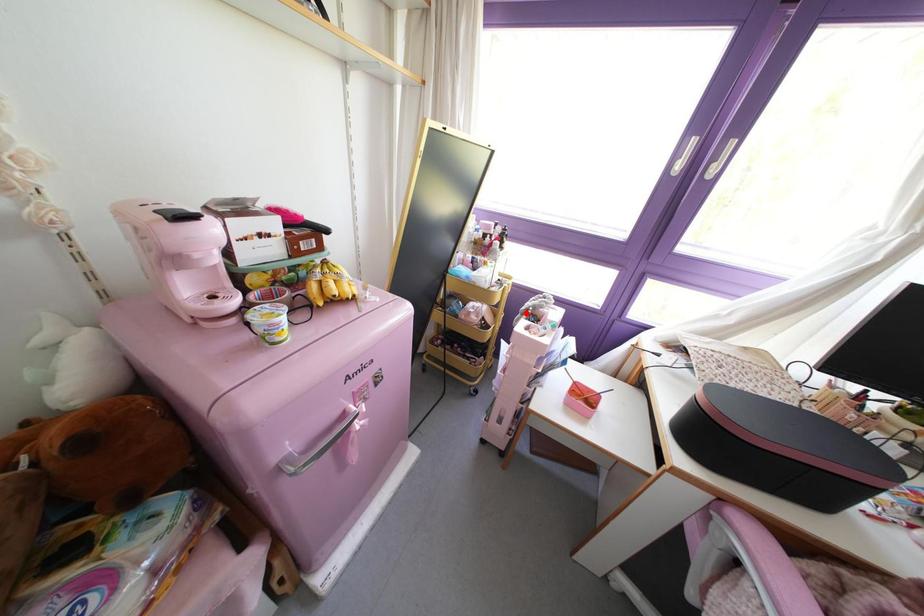
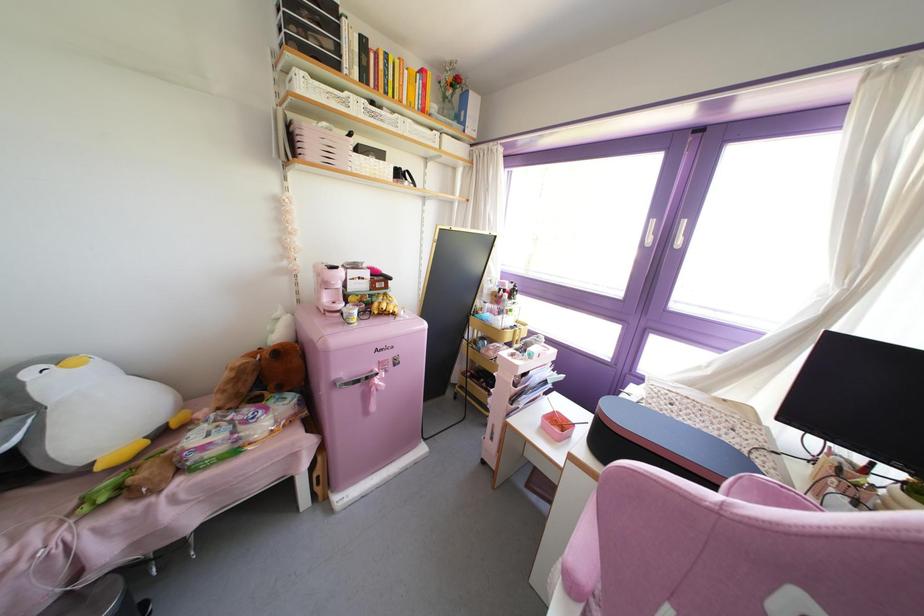
Question: I am providing you with two images of the same scene from different viewpoints. Given a red point in image1, look at the same physical point in image2. Is it:

Choices:
 (A) Closer to the viewpoint
 (B) Farther from the viewpoint

Answer: (B)